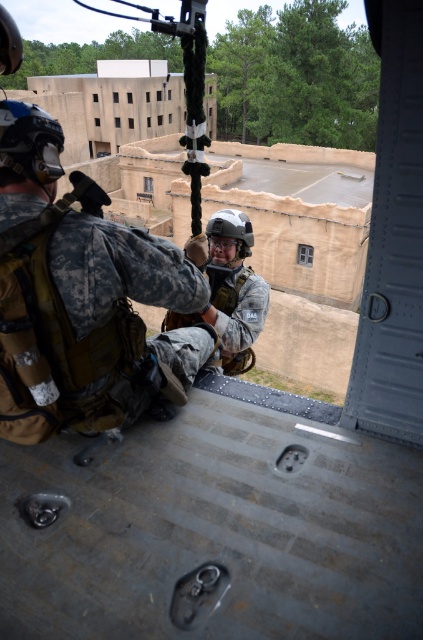
You are a soldier inside the helicopter and need to check the distance between you and the camouflage fabric uniform at left. Can you reach out and touch it without moving your body?

The camouflage fabric uniform at left is 5.73 feet away from you, so you cannot reach it without moving your body since the average human arm span is about 3 feet.

You are a soldier inside the helicopter and need to secure your equipment. The point marked at coordinates (79,296) is part of your uniform. Where on your uniform is this point located?

The point marked at coordinates (79,296) is located on the camouflage fabric uniform at left.

You are a military equipment inspector checking the storage space in the helicopter. You have two items to store temporarily. The first is the camouflage fabric uniform at left, and the second is the camouflage fabric helmet at center. Given the limited space, which item requires more horizontal space to store?

The camouflage fabric uniform at left requires more horizontal space because its width is larger than the camouflage fabric helmet at center.